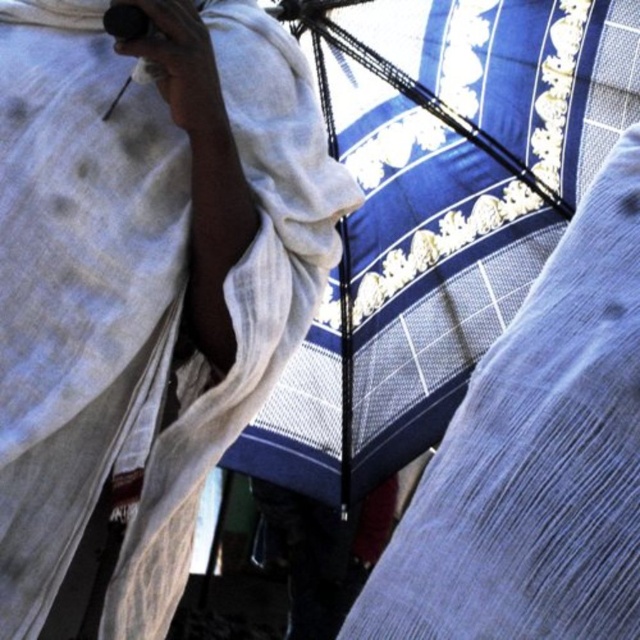
Does blue woven cloth at upper right appear on the right side of blue textured fabric at center?

Incorrect, blue woven cloth at upper right is not on the right side of blue textured fabric at center.

Who is lower down, blue woven cloth at upper right or blue textured fabric at center?

blue textured fabric at center is lower down.

Is point (188, 49) positioned after point (624, 561)?

Yes, it is behind point (624, 561).

Where is `blue woven cloth at upper right`? This screenshot has width=640, height=640. blue woven cloth at upper right is located at coordinates (145, 282).